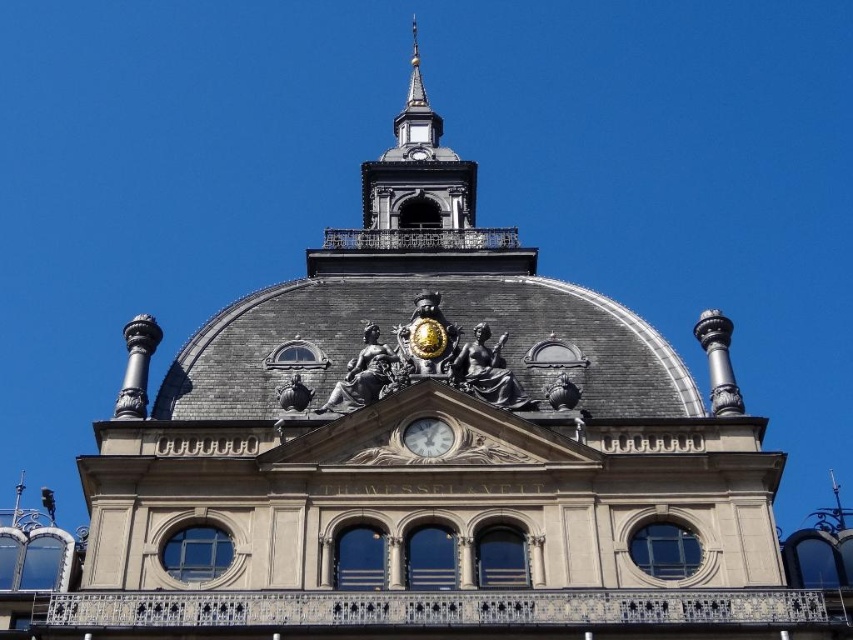
Does polished bronze dome at center have a lesser height compared to polished brass bell tower at upper center?

Yes.

Who is lower down, polished bronze dome at center or polished brass bell tower at upper center?

polished bronze dome at center is below.

Who is more forward, [231,330] or [473,212]?

Positioned in front is point [231,330].

Where is `polished bronze dome at center`? Image resolution: width=853 pixels, height=640 pixels. polished bronze dome at center is located at coordinates (405, 324).

Between polished bronze statue at center and white glossy clock at center, which one appears on the left side from the viewer's perspective?

Positioned to the left is white glossy clock at center.

Between polished bronze statue at center and white glossy clock at center, which one has less height?

white glossy clock at center is shorter.

Who is more forward, (492, 396) or (415, 451)?

Positioned in front is point (415, 451).

Where is `polished bronze statue at center`? polished bronze statue at center is located at coordinates (486, 371).

Looking at this image, between white glossy clock at center and matte bronze sphere at center, which one appears on the left side from the viewer's perspective?

From the viewer's perspective, matte bronze sphere at center appears more on the left side.

Does white glossy clock at center come behind matte bronze sphere at center?

No, white glossy clock at center is in front of matte bronze sphere at center.

Which is in front, point (439, 436) or point (281, 404)?

Point (439, 436) is in front.

At what (x,y) coordinates should I click in order to perform the action: click on white glossy clock at center. Please return your answer as a coordinate pair (x, y). This screenshot has height=640, width=853. Looking at the image, I should click on (427, 436).